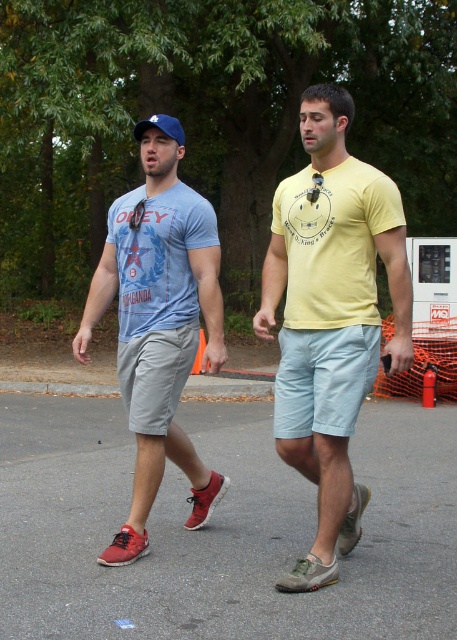
Question: Which of the following is the closest to the observer?

Choices:
 (A) blue fabric baseball cap at upper center
 (B) blue fabric baseball cap at left
 (C) yellow matte t-shirt at center

Answer: (C)

Question: Does yellow matte t-shirt at center appear on the left side of blue fabric baseball cap at upper center?

Choices:
 (A) no
 (B) yes

Answer: (A)

Question: Is yellow matte t-shirt at center further to camera compared to blue fabric baseball cap at left?

Choices:
 (A) no
 (B) yes

Answer: (A)

Question: Which point is closer to the camera taking this photo?

Choices:
 (A) (157, 122)
 (B) (211, 214)
 (C) (344, 410)

Answer: (C)

Question: Which object is closer to the camera taking this photo?

Choices:
 (A) yellow matte t-shirt at center
 (B) blue fabric baseball cap at upper center
 (C) blue fabric baseball cap at left

Answer: (A)

Question: From the image, what is the correct spatial relationship of yellow matte t-shirt at center in relation to blue fabric baseball cap at upper center?

Choices:
 (A) right
 (B) left

Answer: (A)